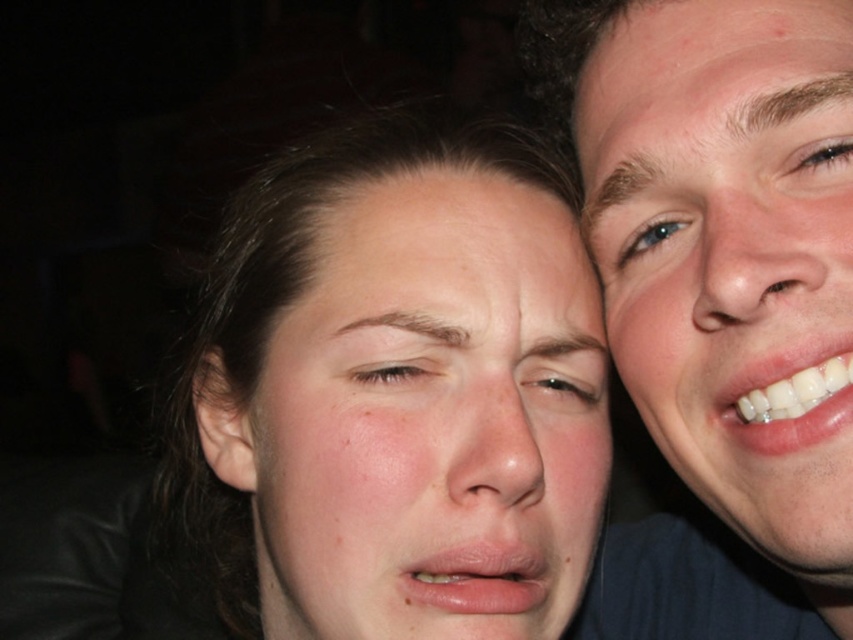
Looking at the scene, which object is positioned to the left of the other? The light brown skin at center and the brown glossy eye at upper right.

The light brown skin at center is to the left of brown glossy eye at upper right.

You are a photographer adjusting the camera settings to ensure both the light brown skin at center and the brown glossy eye at upper right are in focus. Considering their sizes, which object should you prioritize focusing on to ensure clarity?

The light brown skin at center should be prioritized for focus because it is larger in size than the brown glossy eye at upper right, making it more prominent in the image.

You are standing in front of the image and want to touch the two points mentioned. Which point, point (352, 369) or point (831, 157), is closer to you?

Point (352, 369) is closer to you because it is further to the viewer than point (831, 157).